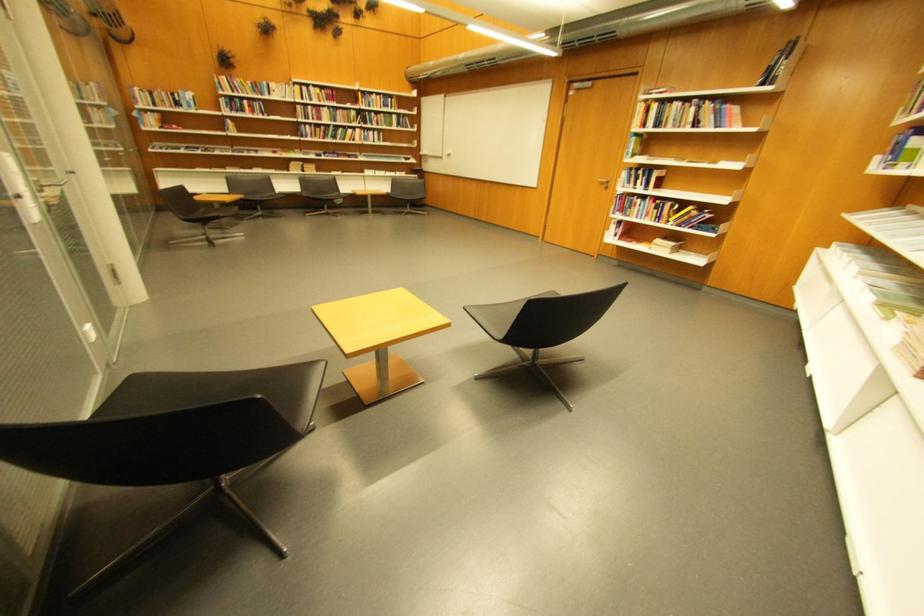
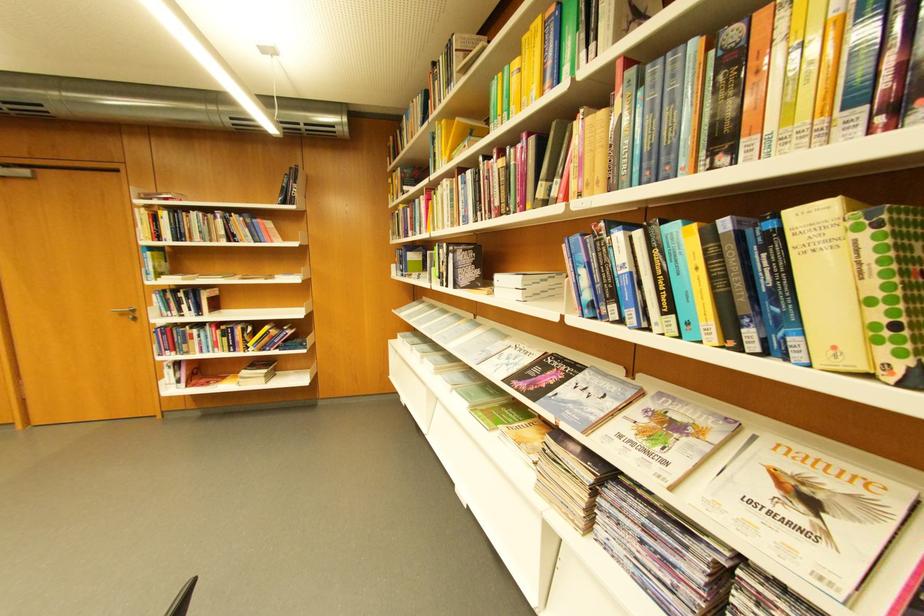
Where in the second image is the point corresponding to (x=612, y=185) from the first image?

(132, 315)